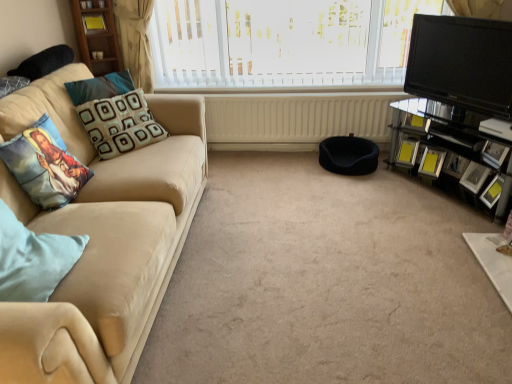
The width and height of the screenshot is (512, 384). Find the location of `free spot in front of yellow glossy picture frame at right, acting as the second picture frame starting from the front`. free spot in front of yellow glossy picture frame at right, acting as the second picture frame starting from the front is located at coordinates 497,219.